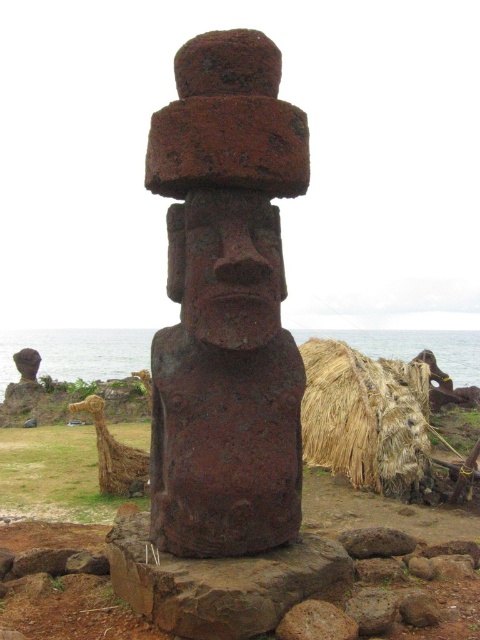
Question: In this image, where is rusty stone statue at center located relative to brown straw mat at lower right?

Choices:
 (A) below
 (B) above

Answer: (B)

Question: Is rusty stone statue at center positioned at the back of brown straw mat at lower right?

Choices:
 (A) no
 (B) yes

Answer: (A)

Question: Observing the image, what is the correct spatial positioning of rusty stone statue at center in reference to brown straw mat at lower right?

Choices:
 (A) right
 (B) left

Answer: (B)

Question: Which object appears closest to the camera in this image?

Choices:
 (A) brown straw mat at lower right
 (B) rusty stone statue at center

Answer: (B)

Question: Which of the following is the closest to the observer?

Choices:
 (A) (416, 419)
 (B) (252, 504)

Answer: (B)